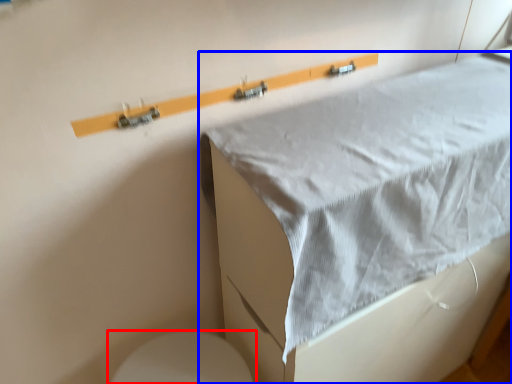
Question: Which of the following is the farthest to the observer, toilet (highlighted by a red box) or furniture (highlighted by a blue box)?

Choices:
 (A) toilet
 (B) furniture

Answer: (A)